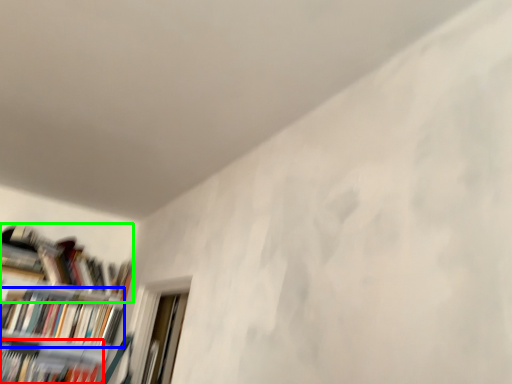
Question: Considering the real-world distances, which object is closest to book (highlighted by a red box)? book (highlighted by a blue box) or book (highlighted by a green box).

Choices:
 (A) book
 (B) book

Answer: (A)